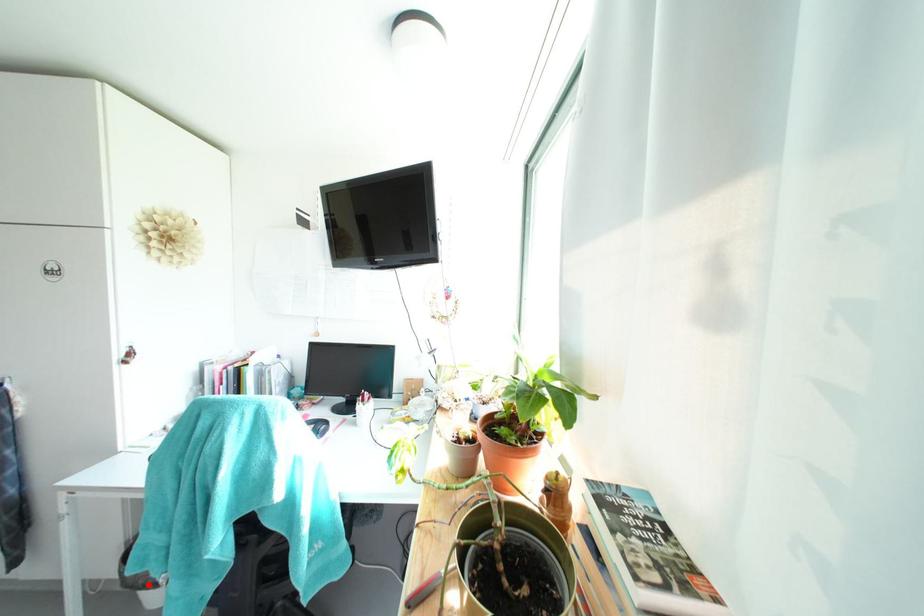
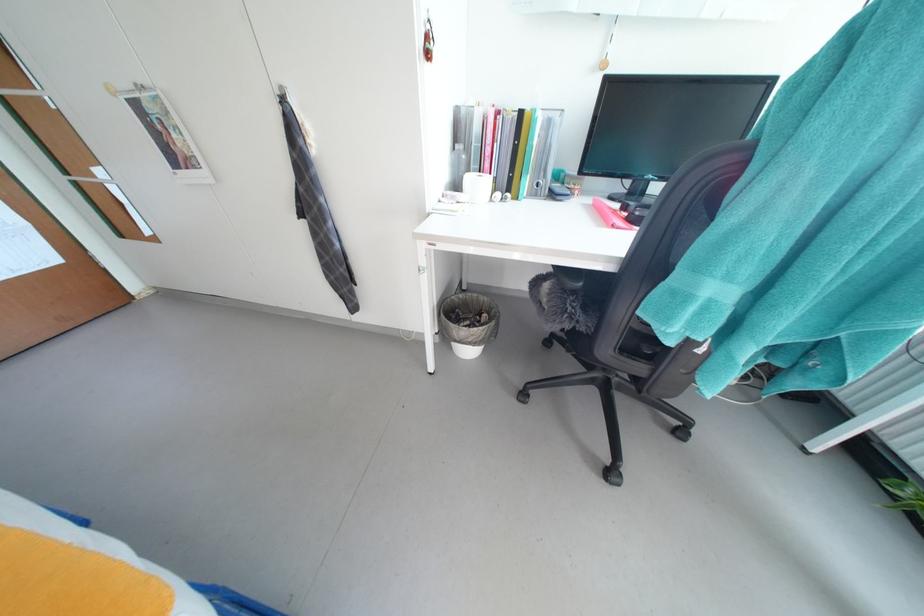
Question: I am providing you with two images of the same scene from different viewpoints. Given a red point in image1, look at the same physical point in image2. Is it:

Choices:
 (A) Closer to the viewpoint
 (B) Farther from the viewpoint

Answer: (B)